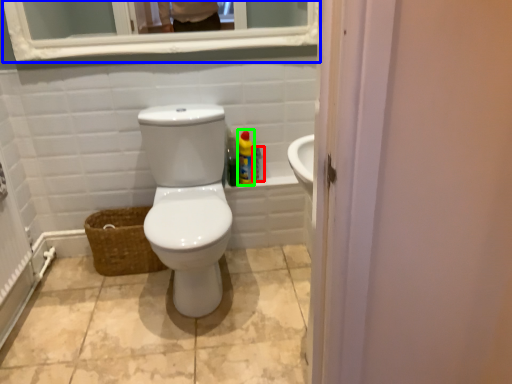
Question: Which object is positioned closest to cleaning product (highlighted by a red box)? Select from medicine cabinet (highlighted by a blue box) and cleaning product (highlighted by a green box).

Choices:
 (A) medicine cabinet
 (B) cleaning product

Answer: (B)